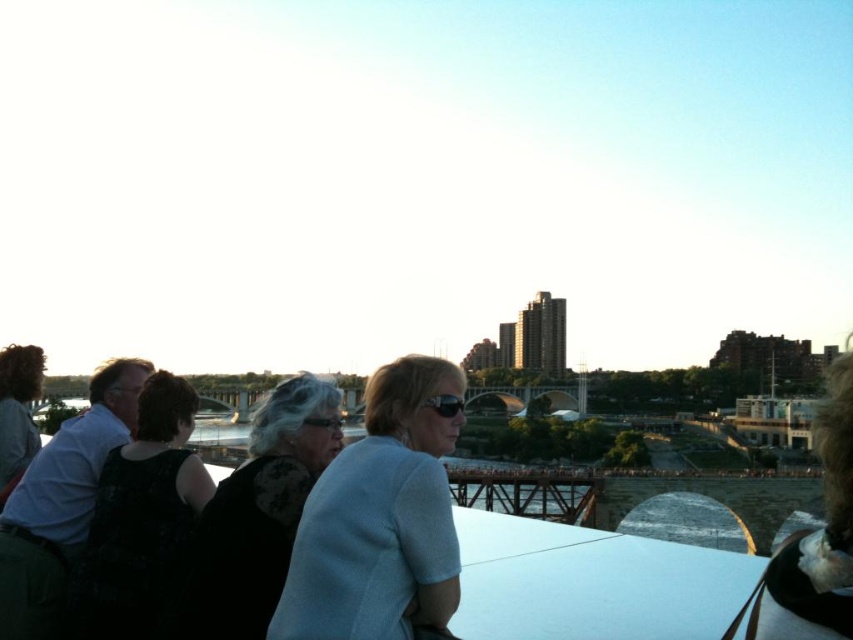
Is black textured dress at center to the right of clear plastic goggles at center from the viewer's perspective?

Incorrect, black textured dress at center is not on the right side of clear plastic goggles at center.

Does point (281, 426) come behind point (322, 417)?

That is False.

The height and width of the screenshot is (640, 853). I want to click on black textured dress at center, so click(258, 515).

Between point (419, 536) and point (311, 419), which one is positioned in front?

Point (419, 536)

Can you confirm if light blue fabric at center is positioned below clear plastic goggles at center?

Correct, light blue fabric at center is located below clear plastic goggles at center.

The height and width of the screenshot is (640, 853). What do you see at coordinates (380, 518) in the screenshot? I see `light blue fabric at center` at bounding box center [380, 518].

Find the location of a particular element. Image resolution: width=853 pixels, height=640 pixels. light blue fabric at center is located at coordinates (380, 518).

Between point (328, 593) and point (122, 540), which one is positioned in front?

Point (328, 593) is more forward.

Find the location of a particular element. light blue fabric at center is located at coordinates (380, 518).